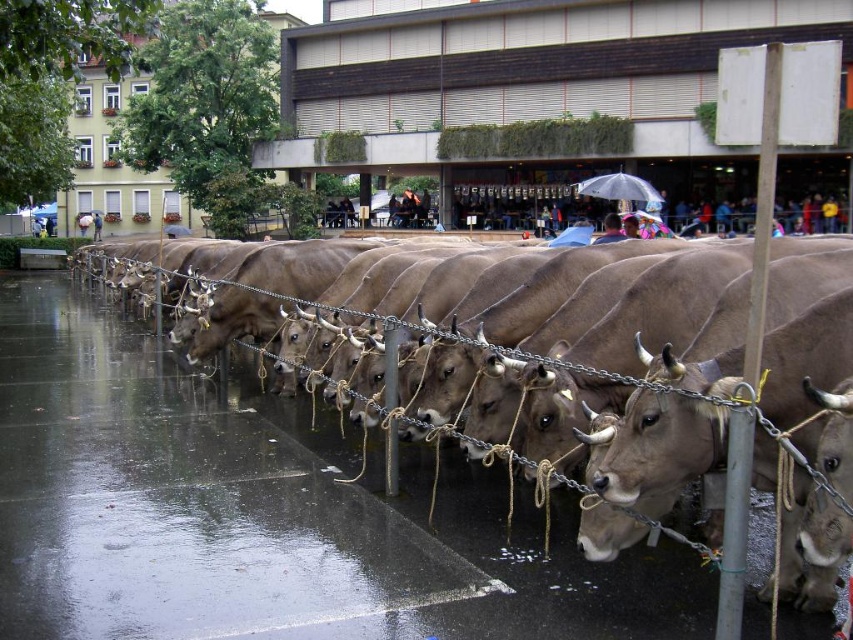
You are a delivery person who needs to cross the wet street while avoiding the herd of cows. You see the brown smooth pavement at center and the transparent plastic umbrella at center. Which object is lower to the ground?

The brown smooth pavement at center is not as tall as the transparent plastic umbrella at center, so the brown smooth pavement at center is lower to the ground.

In the scene shown: You are a pedestrian trying to cross the street where the cows are being herded. You see the brown smooth pavement at center and the transparent plastic umbrella at center. Which object is closer to the left side of the street?

The brown smooth pavement at center is to the left of the transparent plastic umbrella at center, so the brown smooth pavement at center is closer to the left side of the street.